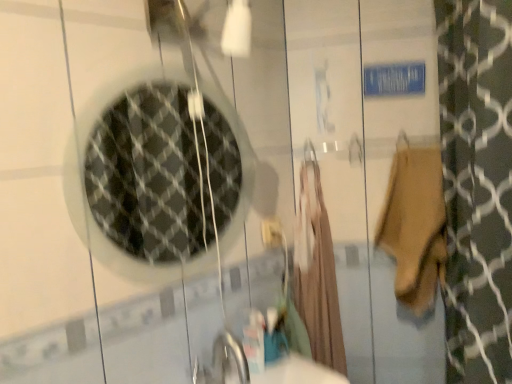
Question: Is beige fabric robe at center smaller than clear glass mirror at upper left?

Choices:
 (A) yes
 (B) no

Answer: (B)

Question: Considering the relative sizes of beige fabric robe at center and clear glass mirror at upper left in the image provided, is beige fabric robe at center shorter than clear glass mirror at upper left?

Choices:
 (A) yes
 (B) no

Answer: (B)

Question: From the image's perspective, would you say beige fabric robe at center is positioned over clear glass mirror at upper left?

Choices:
 (A) yes
 (B) no

Answer: (B)

Question: Is beige fabric robe at center thinner than clear glass mirror at upper left?

Choices:
 (A) no
 (B) yes

Answer: (A)

Question: Is beige fabric robe at center to the left of clear glass mirror at upper left from the viewer's perspective?

Choices:
 (A) yes
 (B) no

Answer: (B)

Question: From the image's perspective, is beige fabric robe at center under clear glass mirror at upper left?

Choices:
 (A) no
 (B) yes

Answer: (B)

Question: Could you tell me if white plastic electric outlet at center is facing clear glass mirror at upper left?

Choices:
 (A) yes
 (B) no

Answer: (B)

Question: Is white plastic electric outlet at center further to camera compared to clear glass mirror at upper left?

Choices:
 (A) yes
 (B) no

Answer: (A)

Question: Is white plastic electric outlet at center bigger than clear glass mirror at upper left?

Choices:
 (A) no
 (B) yes

Answer: (A)

Question: Considering the relative sizes of white plastic electric outlet at center and clear glass mirror at upper left in the image provided, is white plastic electric outlet at center wider than clear glass mirror at upper left?

Choices:
 (A) yes
 (B) no

Answer: (A)

Question: From the image's perspective, is white plastic electric outlet at center below clear glass mirror at upper left?

Choices:
 (A) no
 (B) yes

Answer: (B)

Question: Is white plastic electric outlet at center at the left side of clear glass mirror at upper left?

Choices:
 (A) yes
 (B) no

Answer: (B)

Question: Can you confirm if white plastic electric outlet at center is taller than beige fabric robe at center?

Choices:
 (A) no
 (B) yes

Answer: (A)